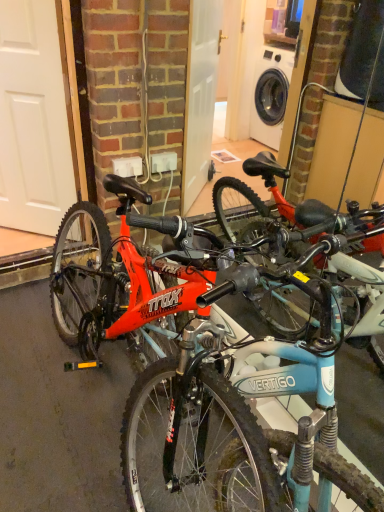
Question: Should I look upward or downward to see white matte door at left?

Choices:
 (A) up
 (B) down

Answer: (A)

Question: Is shiny red bicycle at left a part of white matte door at left?

Choices:
 (A) yes
 (B) no

Answer: (B)

Question: From the image's perspective, is white matte door at left beneath shiny red bicycle at left?

Choices:
 (A) yes
 (B) no

Answer: (B)

Question: Is white matte door at left facing towards shiny red bicycle at left?

Choices:
 (A) yes
 (B) no

Answer: (B)

Question: Is white matte door at left thinner than shiny red bicycle at left?

Choices:
 (A) no
 (B) yes

Answer: (B)

Question: Is white matte door at left smaller than shiny red bicycle at left?

Choices:
 (A) no
 (B) yes

Answer: (B)

Question: Does white matte door at left have a greater width compared to shiny red bicycle at left?

Choices:
 (A) yes
 (B) no

Answer: (B)

Question: Does shiny red bicycle at left have a smaller size compared to white matte door at left?

Choices:
 (A) yes
 (B) no

Answer: (B)

Question: Considering the relative positions of shiny red bicycle at left and white matte door at left in the image provided, is shiny red bicycle at left to the right of white matte door at left from the viewer's perspective?

Choices:
 (A) no
 (B) yes

Answer: (B)

Question: From a real-world perspective, is shiny red bicycle at left on top of white matte door at left?

Choices:
 (A) yes
 (B) no

Answer: (B)

Question: Is shiny red bicycle at left facing towards white matte door at left?

Choices:
 (A) yes
 (B) no

Answer: (B)

Question: Is shiny red bicycle at left beside white matte door at left?

Choices:
 (A) no
 (B) yes

Answer: (A)

Question: Is shiny red bicycle at left located outside white matte door at left?

Choices:
 (A) yes
 (B) no

Answer: (A)

Question: From a real-world perspective, is white matte door at left above or below shiny red bicycle at left?

Choices:
 (A) above
 (B) below

Answer: (A)